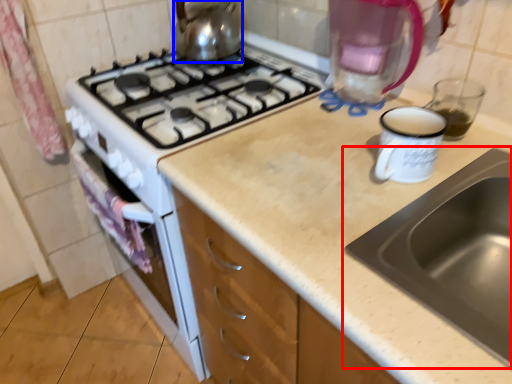
Question: Which point is closer to the camera, sink (highlighted by a red box) or kitchen appliance (highlighted by a blue box)?

Choices:
 (A) sink
 (B) kitchen appliance

Answer: (A)